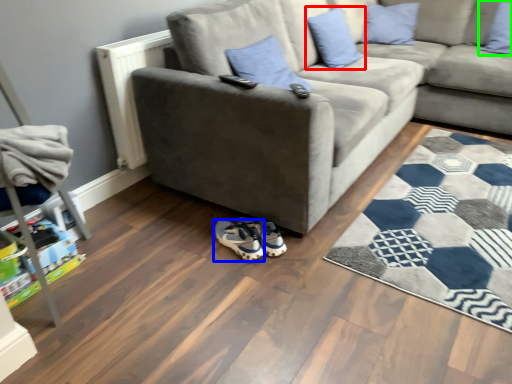
Question: Based on their relative distances, which object is farther from pillow (highlighted by a red box)? Choose from footwear (highlighted by a blue box) and pillow (highlighted by a green box).

Choices:
 (A) footwear
 (B) pillow

Answer: (A)